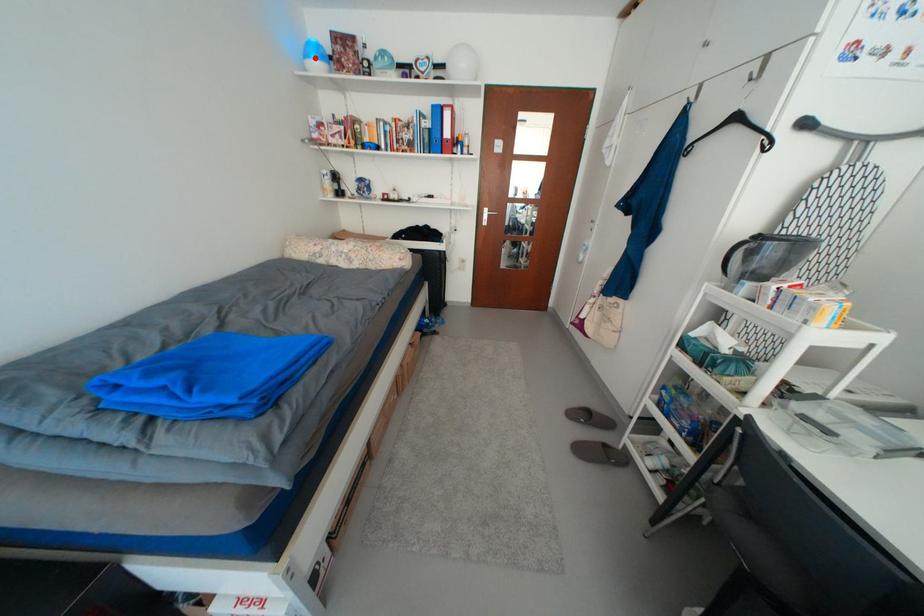
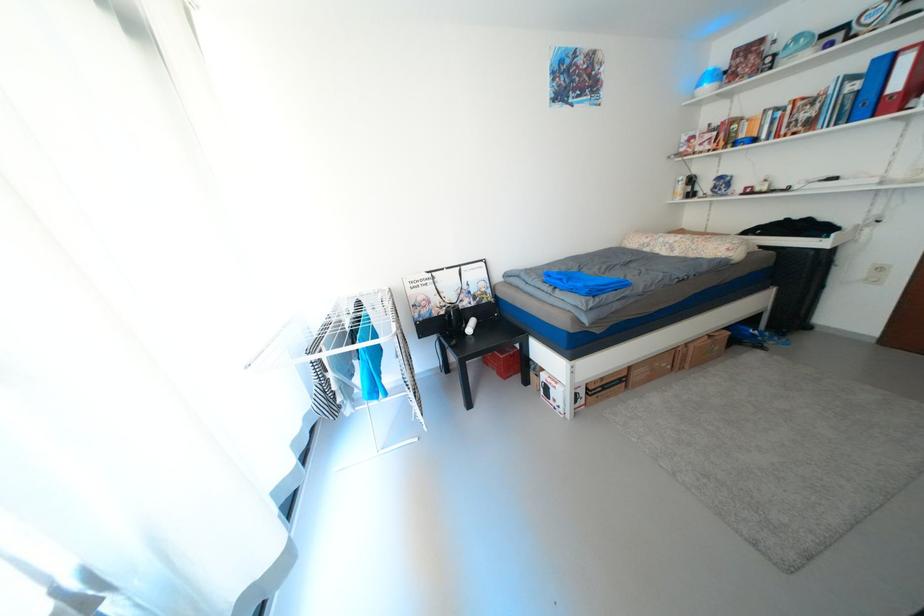
Find the pixel in the second image that matches the highlighted location in the first image.

(707, 87)